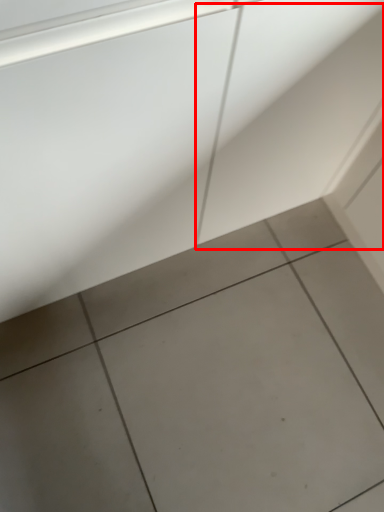
Question: From the image's perspective, what is the correct spatial relationship of concrete (annotated by the red box) in relation to ceramic tile?

Choices:
 (A) above
 (B) below

Answer: (A)